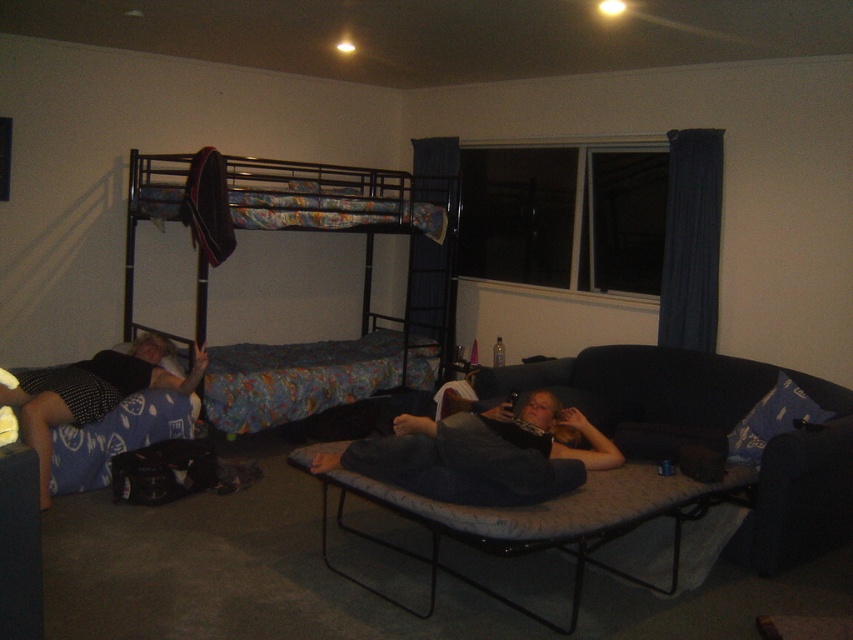
You are standing in the room and want to place a small lamp between the gray fabric couch at lower right and the matte black blanket at lower left. Based on their positions, which object should the lamp be closer to?

The gray fabric couch at lower right is closer to the viewer than the matte black blanket at lower left, so the lamp should be placed closer to the matte black blanket at lower left to maintain equal distance between both objects.

You are trying to navigate to the gray fabric couch at lower right in the room. According to the coordinates provided in the Objects Description, which direction should you move towards from the center of the room?

The gray fabric couch at lower right is located at point coordinates of (x=483, y=454), so you should move towards the lower right direction from the center of the room to reach it.

In the dimly lit room at night, there are two couches, the dark fabric couch at lower right and the gray fabric couch at lower right. Which couch is bigger?

The dark fabric couch at lower right is larger in size compared to the gray fabric couch at lower right.